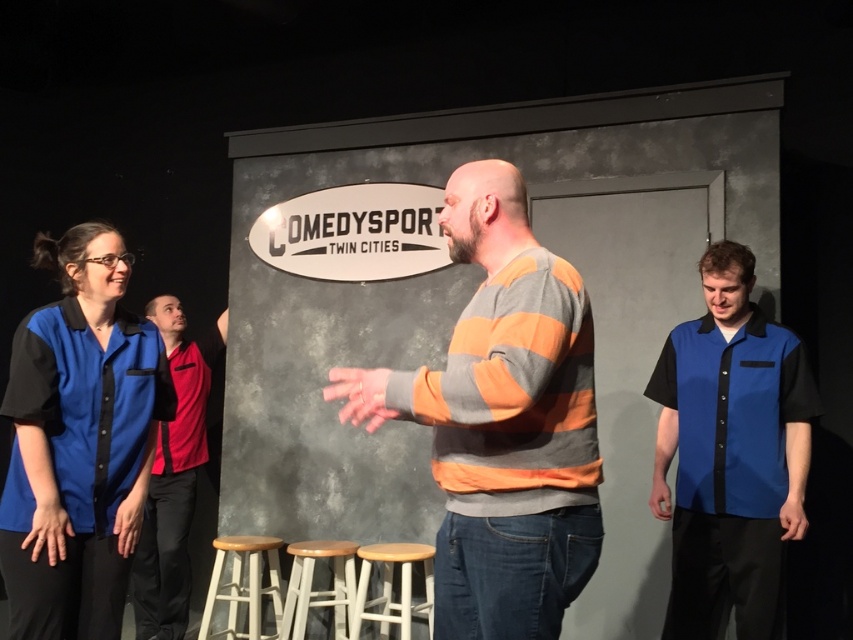
You are a stagehand needing to move a 1.2 meter wide equipment cart from the blue cotton shirt at right to the wooden bar stool at center. Can the cart fit through the space between them?

The distance between the blue cotton shirt at right and the wooden bar stool at center is 1.32 meters. Since the equipment cart is 1.2 meters wide, it can fit through the space as there is enough clearance.